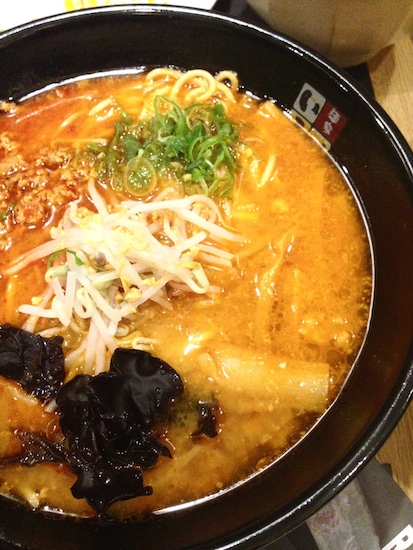
This screenshot has width=413, height=550. In order to click on white on table cloth in this screenshot , I will do `click(364, 531)`, `click(350, 500)`, `click(332, 510)`, `click(341, 539)`.